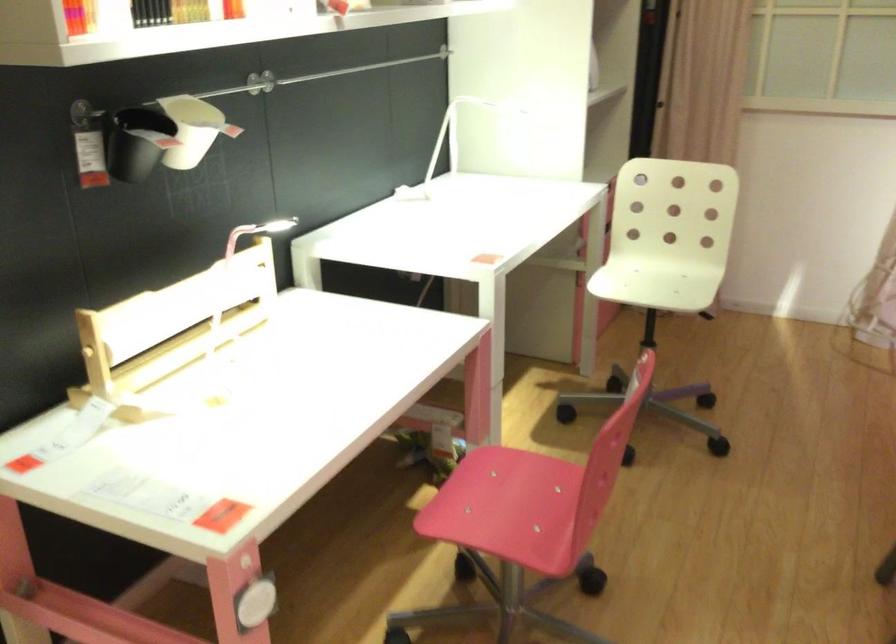
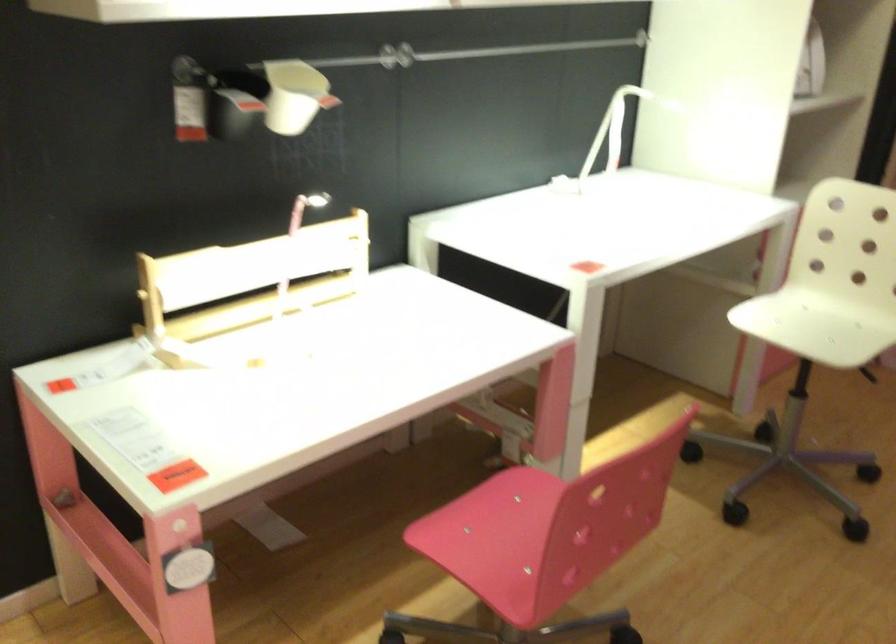
In the second image, find the point that corresponds to pixel 481 509 in the first image.

(479, 535)